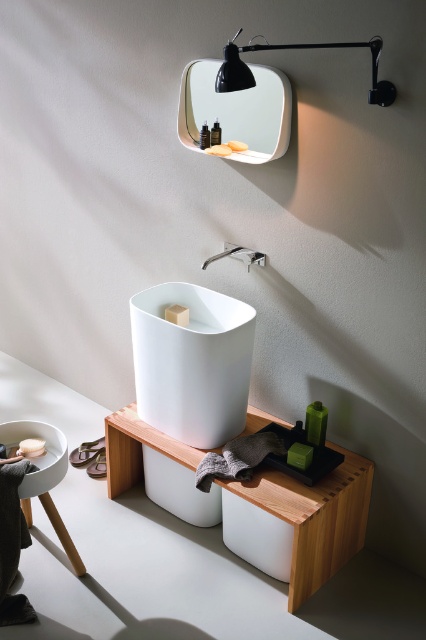
Question: Which object is the closest to the white matte sink at center?

Choices:
 (A) white matte soap at lower left
 (B) white glossy mirror at upper center
 (C) orange matte soap at upper center
 (D) matte white soap at upper center

Answer: (A)

Question: Considering the relative positions of white glossy mirror at upper center and orange matte soap at upper center in the image provided, where is white glossy mirror at upper center located with respect to orange matte soap at upper center?

Choices:
 (A) left
 (B) right

Answer: (A)

Question: Among these points, which one is farthest from the camera?

Choices:
 (A) (141, 400)
 (B) (210, 145)
 (C) (40, 445)

Answer: (A)

Question: Where is white matte sink at center located in relation to black matte wall lamp at upper center in the image?

Choices:
 (A) left
 (B) right

Answer: (A)

Question: Does black matte wall lamp at upper center appear under white matte soap at lower left?

Choices:
 (A) no
 (B) yes

Answer: (A)

Question: Based on their relative distances, which object is farther from the white glossy mirror at upper center?

Choices:
 (A) black matte wall lamp at upper center
 (B) white matte sink at center

Answer: (B)